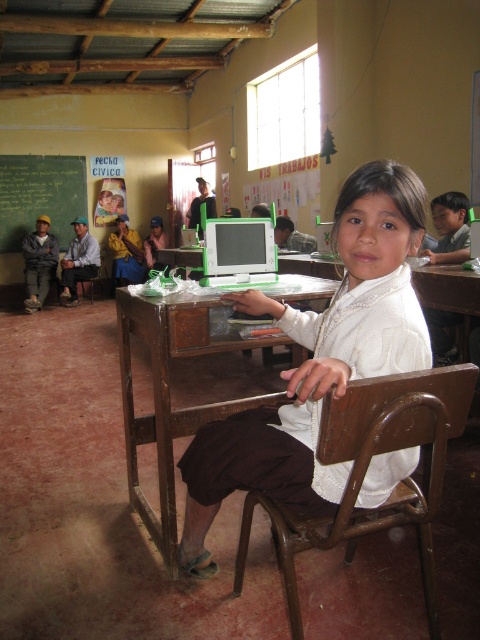
Question: From the image, what is the correct spatial relationship of green chalkboard at upper left in relation to matte gray shirt at left?

Choices:
 (A) right
 (B) left

Answer: (B)

Question: Is brown wooden chair at center wider than dark gray sweater at left?

Choices:
 (A) yes
 (B) no

Answer: (A)

Question: Estimate the real-world distances between objects in this image. Which object is farther from the brown wooden chair at center?

Choices:
 (A) green chalkboard at upper left
 (B) dark gray sweater at left

Answer: (A)

Question: From the image, what is the correct spatial relationship of brown wooden chair at center in relation to green chalkboard at upper left?

Choices:
 (A) right
 (B) left

Answer: (A)

Question: Among these points, which one is nearest to the camera?

Choices:
 (A) (379, 257)
 (B) (46, 234)
 (C) (379, 506)

Answer: (A)

Question: Estimate the real-world distances between objects in this image. Which object is closer to the dark gray sweater at left?

Choices:
 (A) matte yellow shirt at center
 (B) white matte shirt at center
 (C) brown wooden chair at center

Answer: (A)